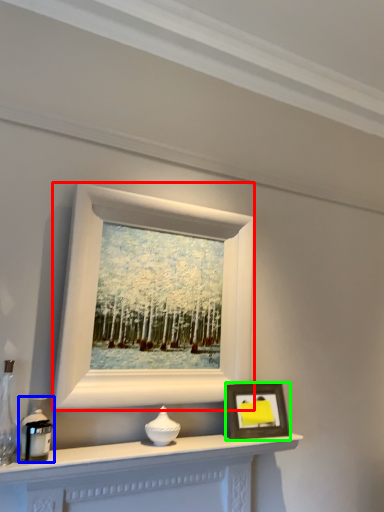
Question: Which object is positioned farthest from picture frame (highlighted by a red box)? Select from candle holder (highlighted by a blue box) and picture frame (highlighted by a green box).

Choices:
 (A) candle holder
 (B) picture frame

Answer: (A)